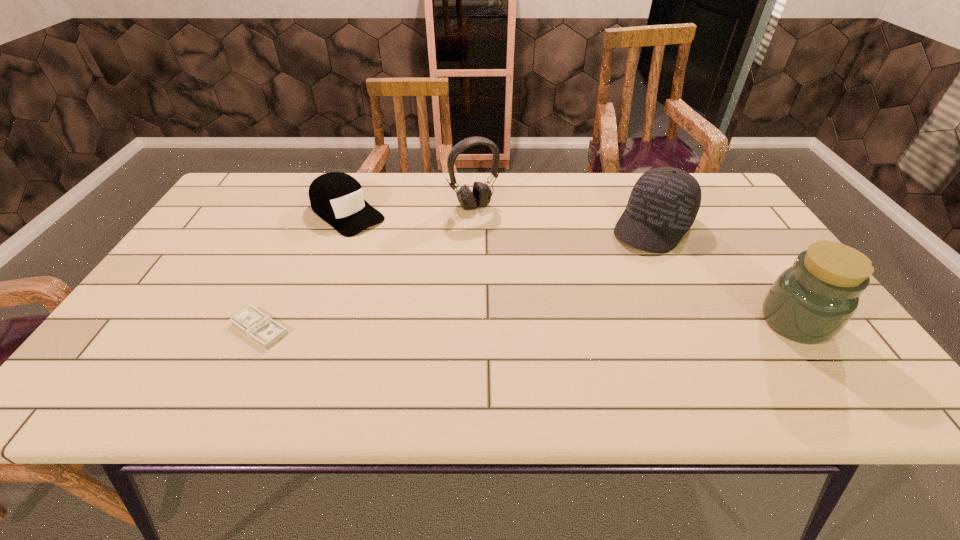
Image resolution: width=960 pixels, height=540 pixels. In order to click on free spot on the desktop that is between the shortest object and the rightmost object and is positioned on the front-facing side of the third object from left to right in this screenshot , I will do `click(565, 325)`.

This screenshot has height=540, width=960. I want to click on free space on the desktop that is between the shortest object and the jar and is positioned at the front of the baseball cap where the brim is located, so click(x=571, y=325).

The width and height of the screenshot is (960, 540). What are the coordinates of `free space on the desktop that is between the shortest object and the jar and is positioned on the front-facing side of the fourth tallest object` in the screenshot? It's located at (492, 326).